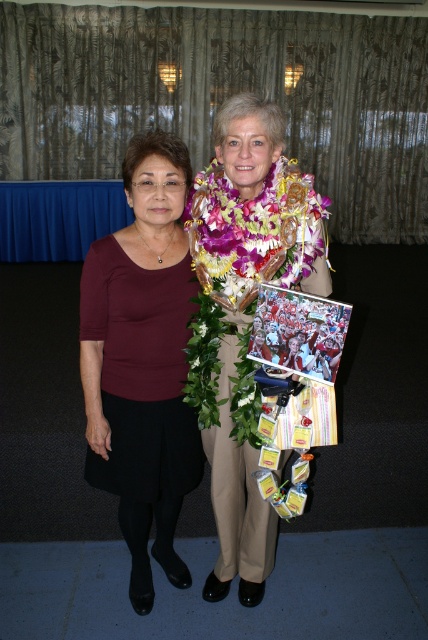
Question: Which point is closer to the camera taking this photo?

Choices:
 (A) (195, 394)
 (B) (175, 253)
 (C) (285, 188)

Answer: (C)

Question: Is matte brown blouse at left further to camera compared to hawaiian lei at center?

Choices:
 (A) no
 (B) yes

Answer: (B)

Question: Can you confirm if matte brown blouse at left is bigger than maroon fabric blouse at left?

Choices:
 (A) yes
 (B) no

Answer: (A)

Question: Does maroon fabric blouse at left appear under hawaiian lei at center?

Choices:
 (A) yes
 (B) no

Answer: (A)

Question: Based on their relative distances, which object is nearer to the maroon fabric blouse at left?

Choices:
 (A) matte brown blouse at left
 (B) hawaiian lei at center

Answer: (A)

Question: Which of the following is the closest to the observer?

Choices:
 (A) (219, 362)
 (B) (256, 413)
 (C) (109, 353)

Answer: (B)